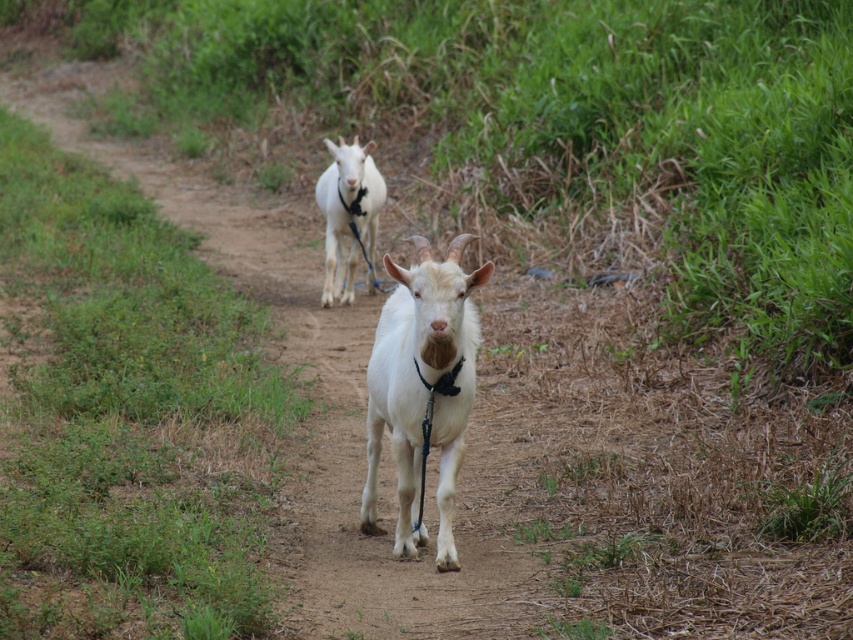
How much distance is there between white matte goat at center and white soft fur goat at center?

14.18 feet

Who is positioned more to the left, white matte goat at center or white soft fur goat at center?

From the viewer's perspective, white soft fur goat at center appears more on the left side.

Which is behind, point (393, 410) or point (341, 225)?

The point (341, 225) is behind.

Identify the location of white matte goat at center. (422, 387).